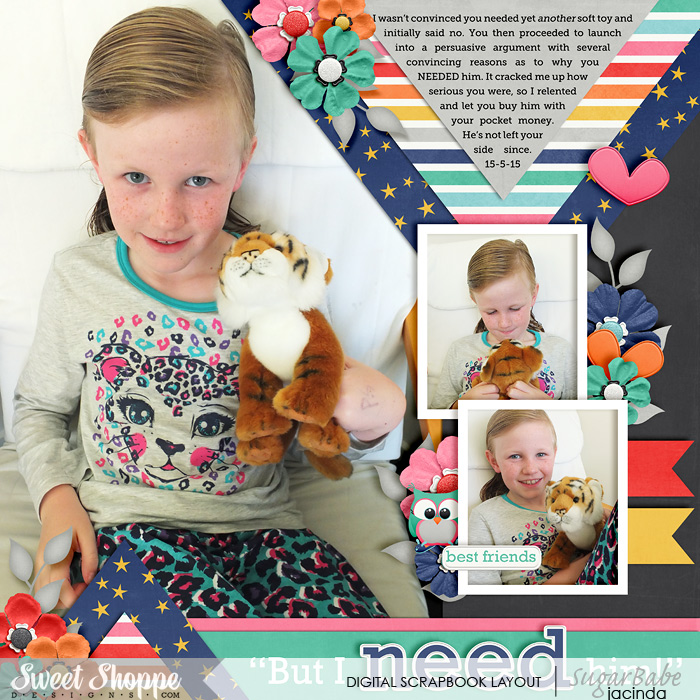
At what (x,y) coordinates should I click in order to perform the action: click on pictures. Please return your answer as a coordinate pair (x, y). Looking at the image, I should click on (496, 332).